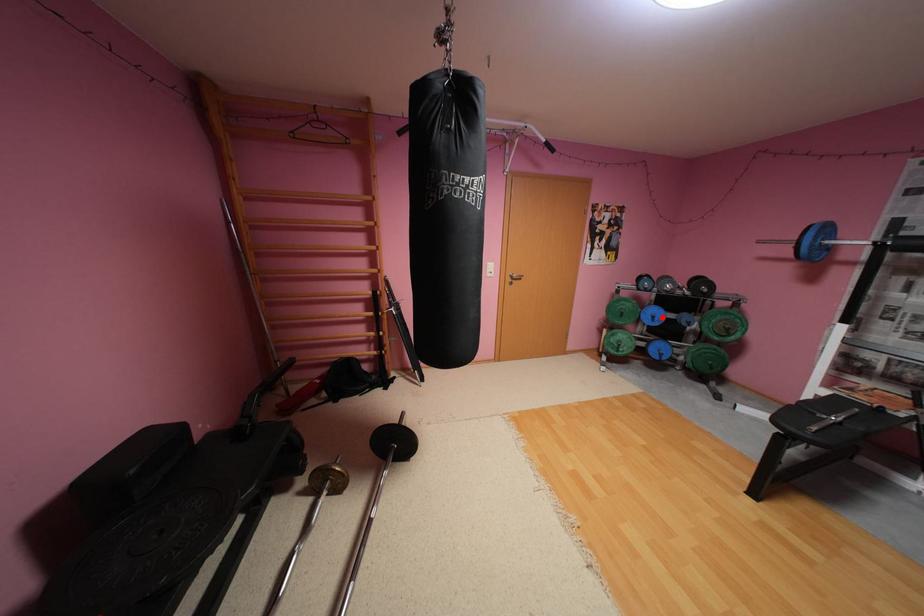
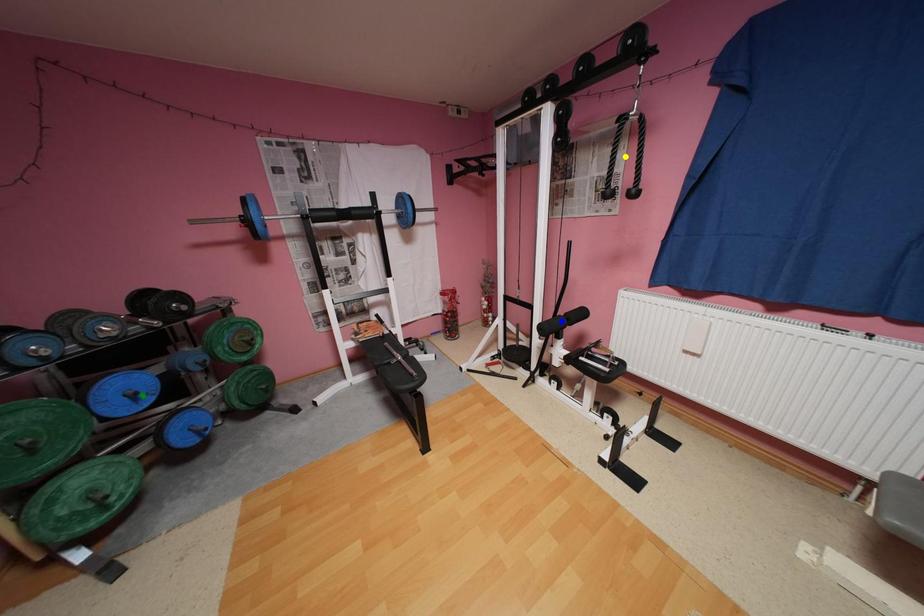
Question: I am providing you with two images of the same scene from different viewpoints. A red point is marked on the first image. You are given multiple points on the second image. Which point in image 2 is actually the same real-world point as the red point in image 1?

Choices:
 (A) yellow point
 (B) blue point
 (C) green point

Answer: (C)